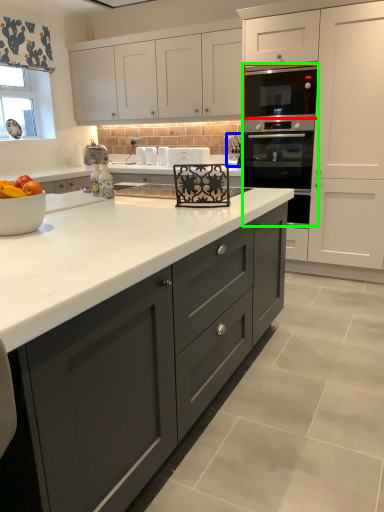
Question: Considering the real-world distances, which object is farthest from appliance (highlighted by a red box)? appliance (highlighted by a blue box) or oven (highlighted by a green box)?

Choices:
 (A) appliance
 (B) oven

Answer: (A)